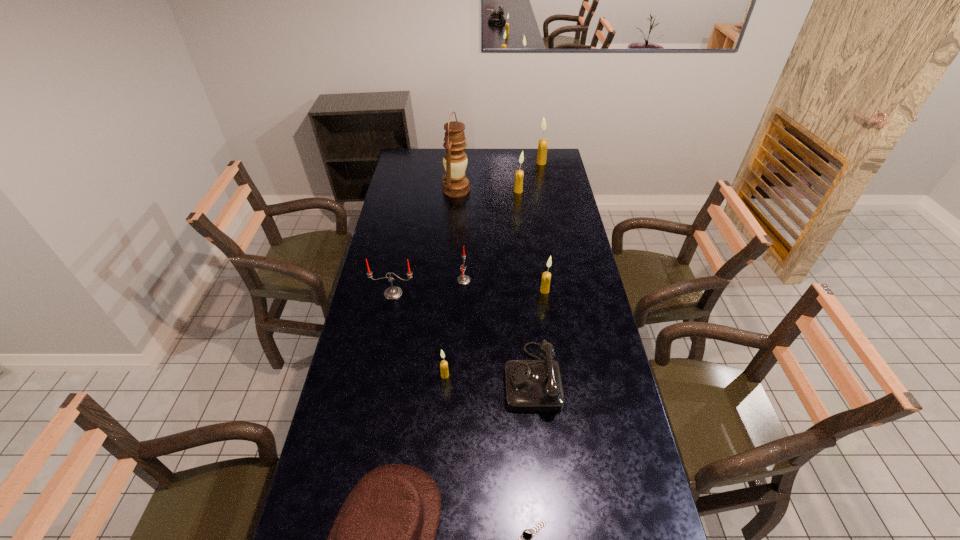
Image resolution: width=960 pixels, height=540 pixels. I want to click on the smallest cream candle, so click(x=443, y=364).

Find the location of a particular element. The width and height of the screenshot is (960, 540). the leftmost cream candle is located at coordinates (443, 364).

Identify the location of the smaller red candle. The height and width of the screenshot is (540, 960). (463, 279).

The image size is (960, 540). Find the location of `the fourth candle from right to left`. the fourth candle from right to left is located at coordinates (463, 279).

The height and width of the screenshot is (540, 960). What are the coordinates of `vacant space located 0.230m on the back of the oil lamp` in the screenshot? It's located at (459, 157).

Identify the location of vacant region located on the front of the rightmost cream candle. (544, 179).

In order to click on free space located on the left of the third nearest cream candle in this screenshot , I will do `click(482, 191)`.

This screenshot has width=960, height=540. I want to click on vacant space located on the back of the third cream candle from left to right, so click(541, 267).

Where is `free space located 0.280m on the front-facing side of the left red candle`? The width and height of the screenshot is (960, 540). free space located 0.280m on the front-facing side of the left red candle is located at coordinates 380,360.

Where is `free region located 0.100m on the dial of the black telephone`? The width and height of the screenshot is (960, 540). free region located 0.100m on the dial of the black telephone is located at coordinates (474, 377).